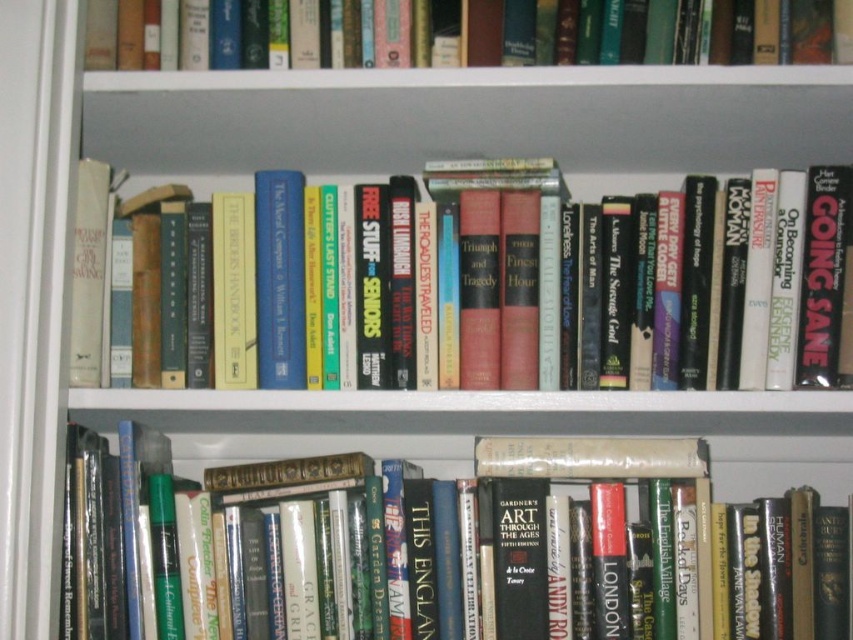
Based on the photo, you are organizing books on a bookshelf and have two hardcover books to place. The hardcover book at center and the hardcover book at lower center. Which book has a smaller width?

The hardcover book at center has a smaller width than the hardcover book at lower center.

You are organizing books on a bookshelf and see the hardcover book at lower center and the hardcover book at upper center. Which book is positioned lower on the shelf?

The hardcover book at lower center is positioned lower than the hardcover book at upper center.